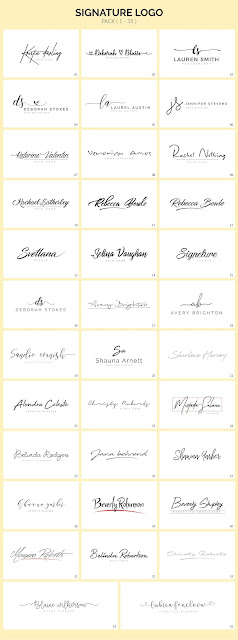
Find the location of a particular element. The image size is (238, 640). three boxes in row is located at coordinates (63, 540), (95, 541), (173, 541).